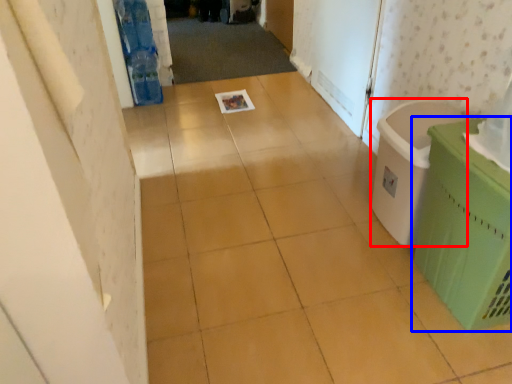
Question: Which object is further to the camera taking this photo, laundry basket (highlighted by a red box) or waste container (highlighted by a blue box)?

Choices:
 (A) laundry basket
 (B) waste container

Answer: (A)